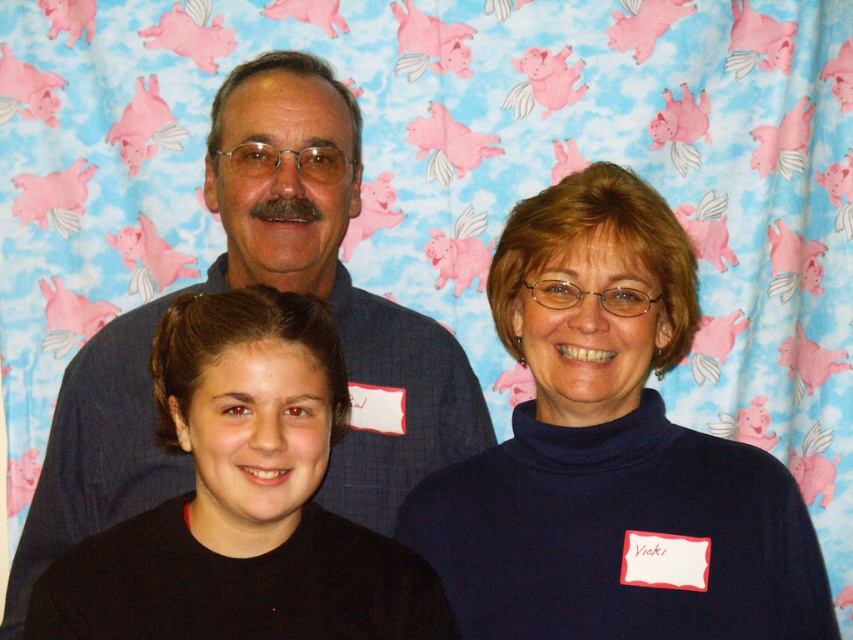
Based on the scene described, which object is narrower between the dark blue turtleneck sweater at center and the blue denim shirt at upper center?

The dark blue turtleneck sweater at center is narrower than the blue denim shirt at upper center.

From the picture: Based on the scene description, which object is positioned closer to the viewer between the dark blue turtleneck sweater at center and the blue denim shirt at upper center?

The dark blue turtleneck sweater at center is positioned closer to the viewer than the blue denim shirt at upper center according to the spatial relationship described.